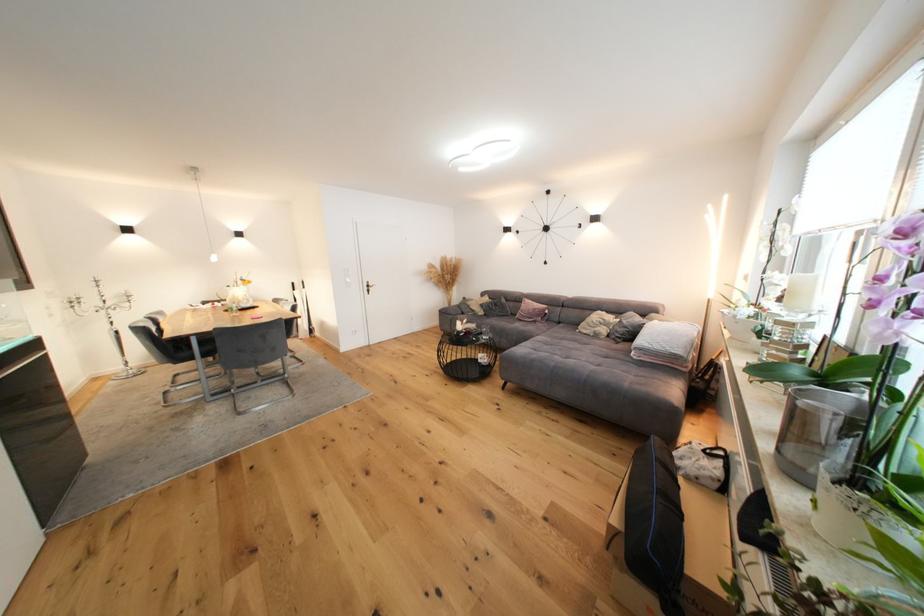
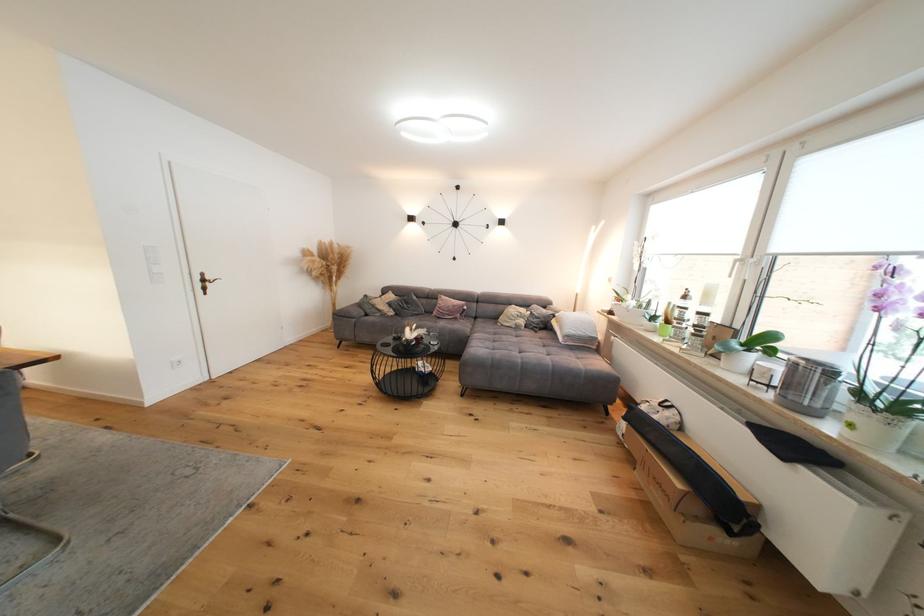
Where in the second image is the point corresponding to pixel 468 334 from the first image?

(419, 342)